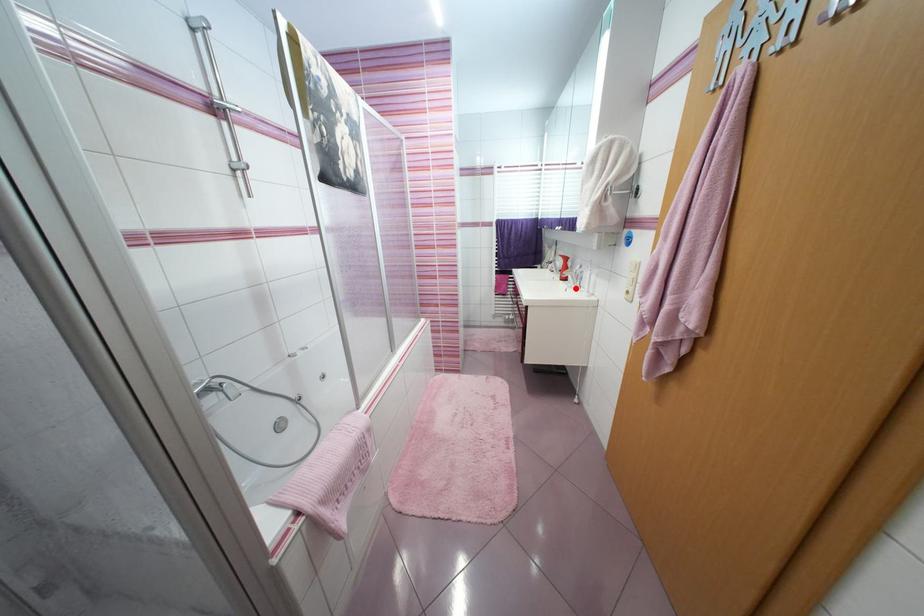
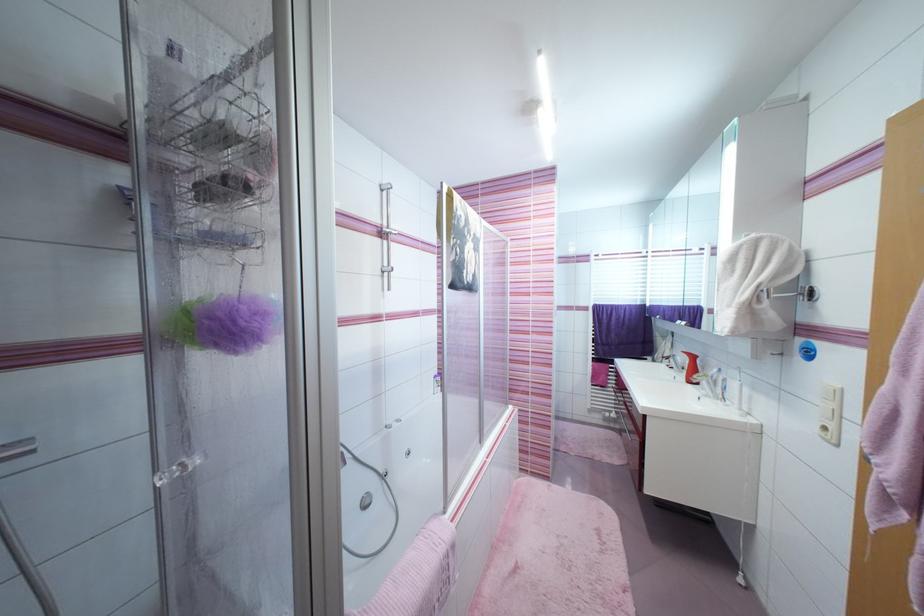
Where in the second image is the point corresponding to the highlighted location from the first image?

(711, 398)